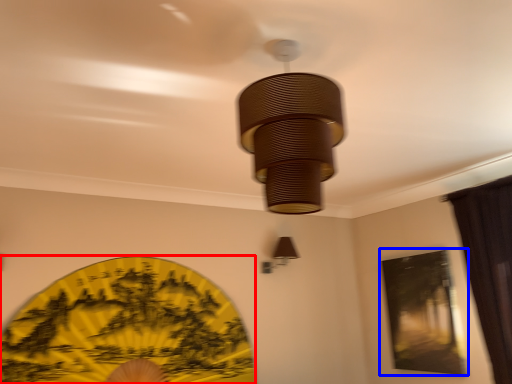
Question: Among these objects, which one is farthest to the camera, design (highlighted by a red box) or window screen (highlighted by a blue box)?

Choices:
 (A) design
 (B) window screen

Answer: (B)